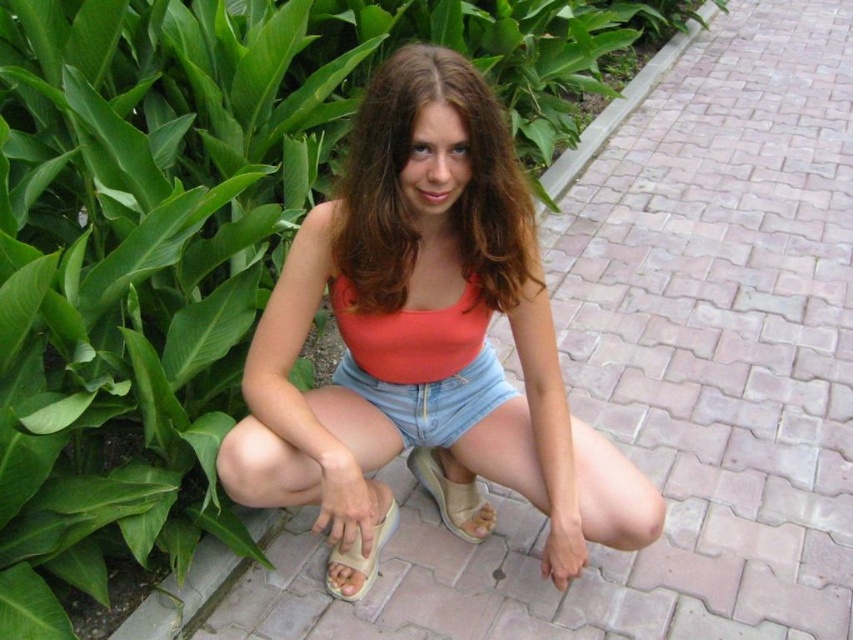
Question: Is matte coral tank top at center closer to the viewer compared to beige suede sandal at lower center?

Choices:
 (A) no
 (B) yes

Answer: (B)

Question: Which point is closer to the camera?

Choices:
 (A) (462, 467)
 (B) (345, 282)
 (C) (439, 387)

Answer: (B)

Question: Based on their relative distances, which object is nearer to the denim shorts at center?

Choices:
 (A) matte orange tank top at center
 (B) matte coral tank top at center
 (C) matte coral bikini top at center
 (D) beige fabric sandal at lower center

Answer: (C)

Question: Where is matte orange tank top at center located in relation to beige fabric sandal at lower center in the image?

Choices:
 (A) right
 (B) left

Answer: (B)

Question: Which object is farther from the camera taking this photo?

Choices:
 (A) matte orange tank top at center
 (B) matte coral tank top at center
 (C) beige fabric sandal at lower center
 (D) matte coral bikini top at center

Answer: (C)

Question: Does matte coral bikini top at center appear on the left side of beige suede sandal at lower center?

Choices:
 (A) yes
 (B) no

Answer: (B)